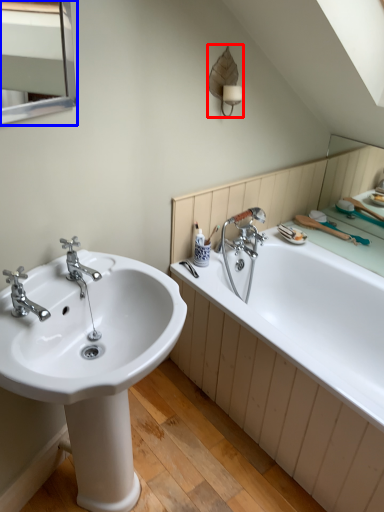
Question: Which point is further to the camera, fixture (highlighted by a red box) or medicine cabinet (highlighted by a blue box)?

Choices:
 (A) fixture
 (B) medicine cabinet

Answer: (A)